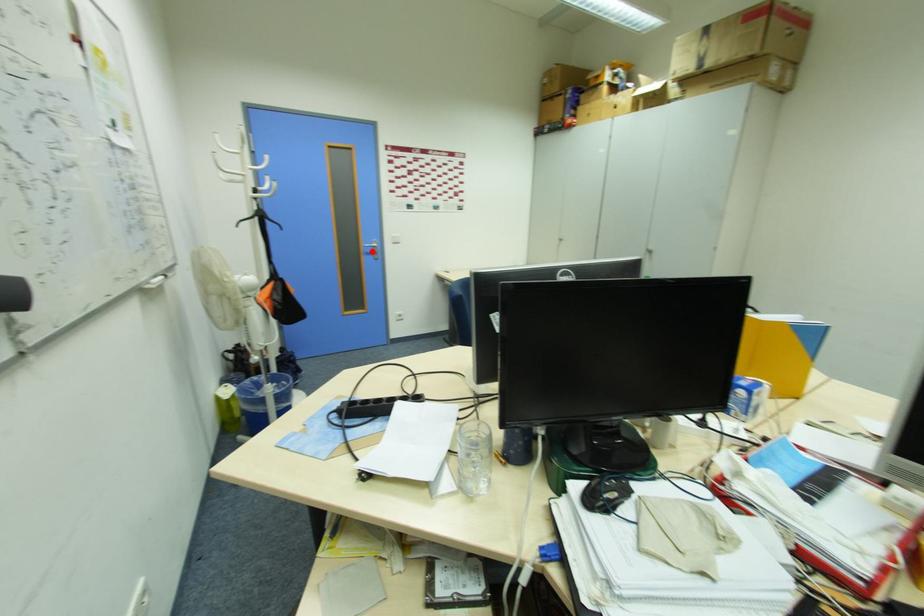
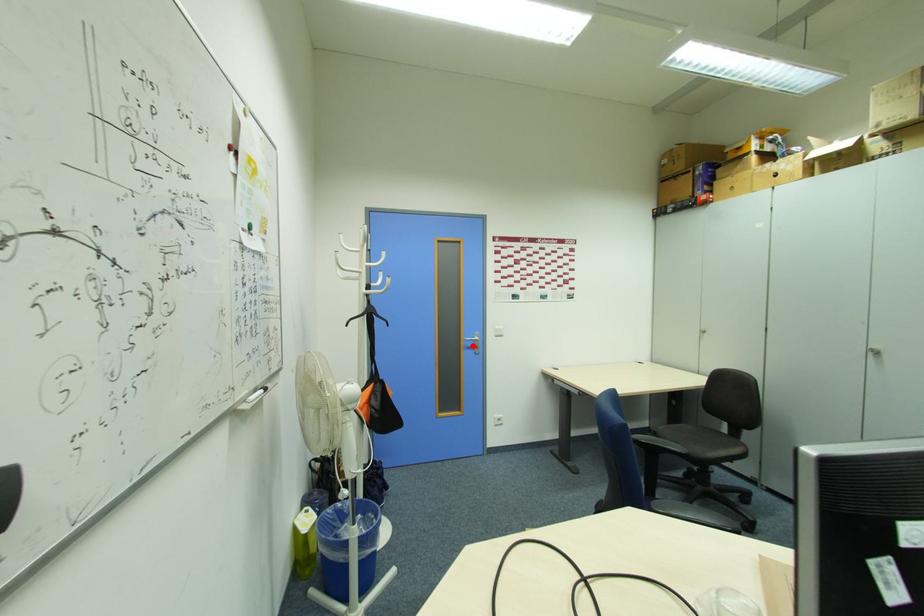
I am providing you with two images of the same scene from different viewpoints. A red point is marked on the first image and another point is marked on the second image. Do the highlighted points in image1 and image2 indicate the same real-world spot?

Yes